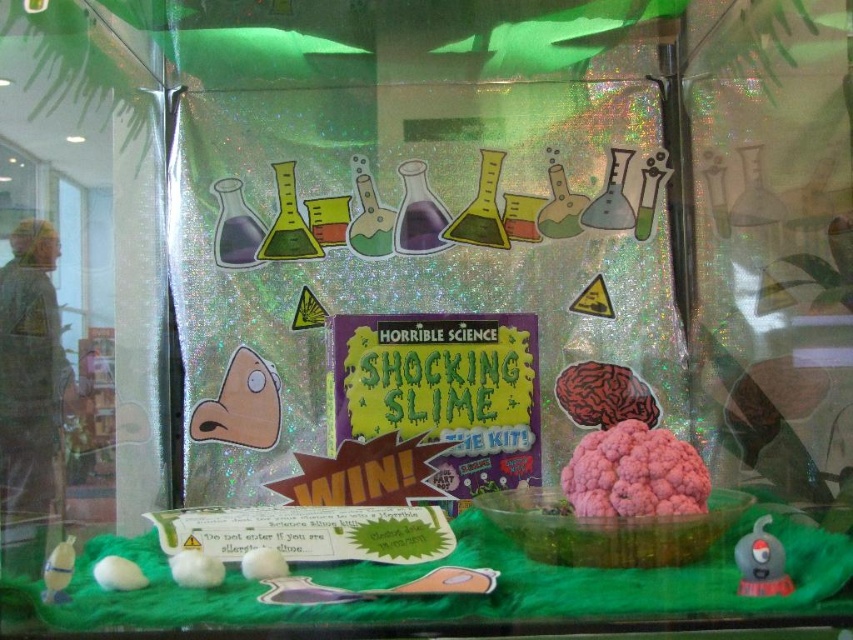
Question: Can you confirm if holographic plastic box at center is positioned below green matte poster at center?

Choices:
 (A) yes
 (B) no

Answer: (B)

Question: Is holographic plastic box at center smaller than green matte poster at center?

Choices:
 (A) yes
 (B) no

Answer: (B)

Question: Does holographic plastic box at center appear under green matte poster at center?

Choices:
 (A) no
 (B) yes

Answer: (A)

Question: Which point is farther to the camera?

Choices:
 (A) holographic plastic box at center
 (B) green matte poster at center

Answer: (B)

Question: Which point is closer to the camera?

Choices:
 (A) green matte poster at center
 (B) holographic plastic box at center

Answer: (B)